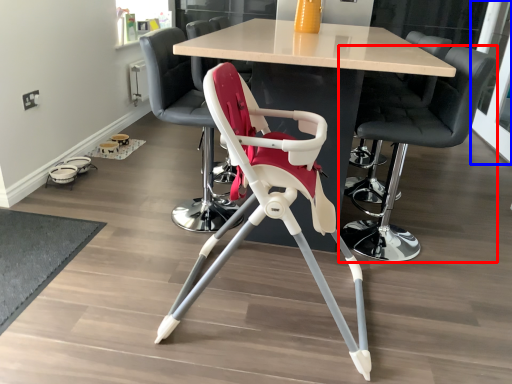
Question: Which point is closer to the camera, chair (highlighted by a red box) or glass door (highlighted by a blue box)?

Choices:
 (A) chair
 (B) glass door

Answer: (A)